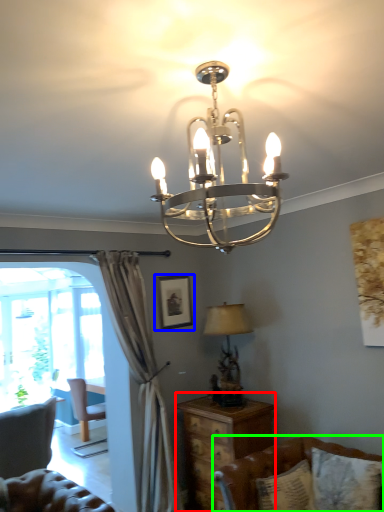
Question: Estimate the real-world distances between objects in this image. Which object is closer to nightstand (highlighted by a red box), picture frame (highlighted by a blue box) or studio couch (highlighted by a green box)?

Choices:
 (A) picture frame
 (B) studio couch

Answer: (B)